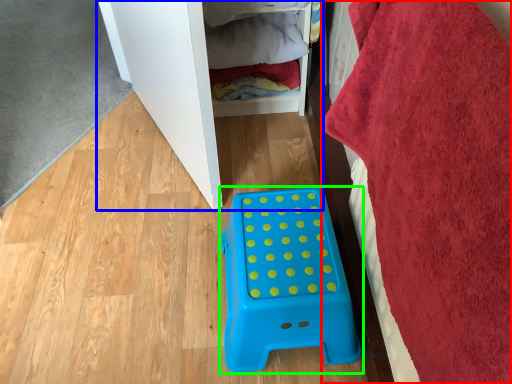
Question: Which object is the farthest from bath towel (highlighted by a red box)? Choose among these: furniture (highlighted by a blue box) or furniture (highlighted by a green box).

Choices:
 (A) furniture
 (B) furniture

Answer: (A)